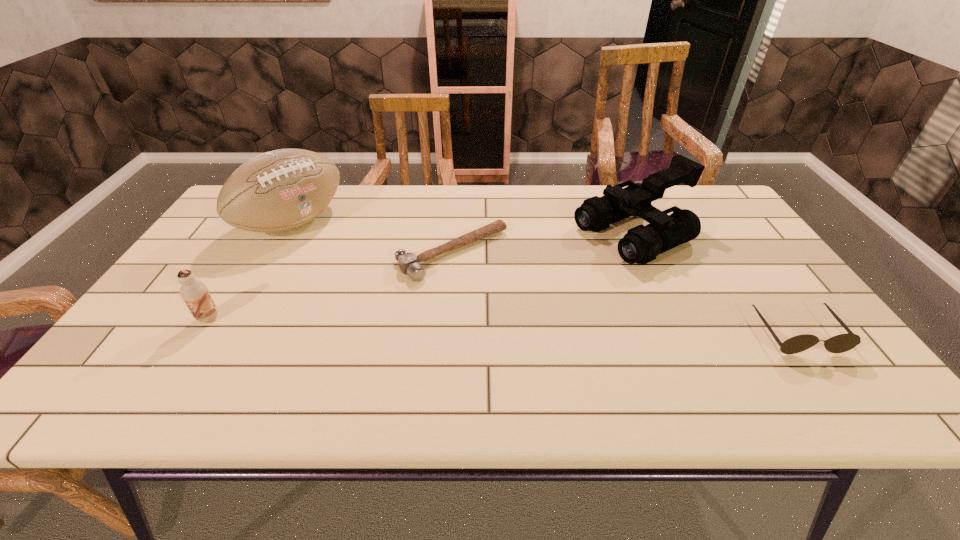
This screenshot has width=960, height=540. What are the coordinates of `vacant space on the desktop that is between the chocolate milk and the fourth tallest object and is positioned on the laces of the football (American)` in the screenshot? It's located at (452, 325).

Find the location of a particular element. This screenshot has width=960, height=540. free spot on the desktop that is between the chocolate milk and the sunglasses and is positioned on the striking face of the third object from right to left is located at coordinates (532, 327).

The image size is (960, 540). In order to click on free spot on the desktop that is between the third shortest object and the sunglasses and is positioned on the front lenses of the fourth object from left to right in this screenshot , I will do `click(423, 324)`.